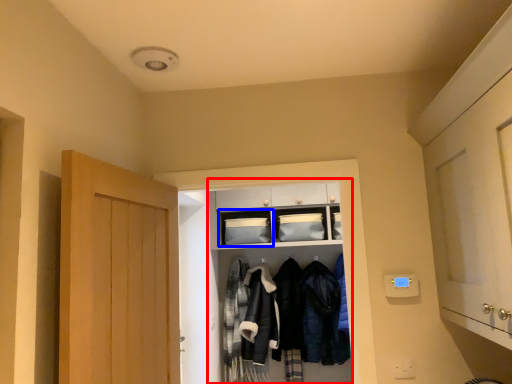
Question: Which object is closer to the camera taking this photo, closet (highlighted by a red box) or shelf (highlighted by a blue box)?

Choices:
 (A) closet
 (B) shelf

Answer: (A)